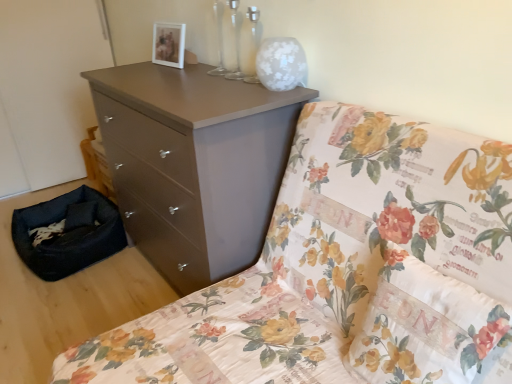
Question: Is matte brown dresser at center further to the viewer compared to black fabric pet bed at lower left?

Choices:
 (A) no
 (B) yes

Answer: (A)

Question: Is matte brown dresser at center far away from black fabric pet bed at lower left?

Choices:
 (A) yes
 (B) no

Answer: (A)

Question: Is the depth of matte brown dresser at center less than that of black fabric pet bed at lower left?

Choices:
 (A) yes
 (B) no

Answer: (A)

Question: Does matte brown dresser at center contain black fabric pet bed at lower left?

Choices:
 (A) yes
 (B) no

Answer: (B)

Question: Can you confirm if matte brown dresser at center is bigger than black fabric pet bed at lower left?

Choices:
 (A) yes
 (B) no

Answer: (A)

Question: From the image's perspective, is matte brown dresser at center above black fabric pet bed at lower left?

Choices:
 (A) yes
 (B) no

Answer: (B)

Question: Can you confirm if matte brown dresser at center is taller than matte brown chest of drawers at upper center?

Choices:
 (A) no
 (B) yes

Answer: (A)

Question: Can you confirm if matte brown dresser at center is thinner than matte brown chest of drawers at upper center?

Choices:
 (A) yes
 (B) no

Answer: (B)

Question: Can you confirm if matte brown dresser at center is bigger than matte brown chest of drawers at upper center?

Choices:
 (A) yes
 (B) no

Answer: (A)

Question: Can you confirm if matte brown dresser at center is positioned to the left of matte brown chest of drawers at upper center?

Choices:
 (A) no
 (B) yes

Answer: (A)

Question: Is matte brown dresser at center positioned before matte brown chest of drawers at upper center?

Choices:
 (A) yes
 (B) no

Answer: (A)

Question: From a real-world perspective, is matte brown dresser at center physically below matte brown chest of drawers at upper center?

Choices:
 (A) yes
 (B) no

Answer: (B)

Question: Is matte brown chest of drawers at upper center directly adjacent to matte brown dresser at center?

Choices:
 (A) no
 (B) yes

Answer: (A)